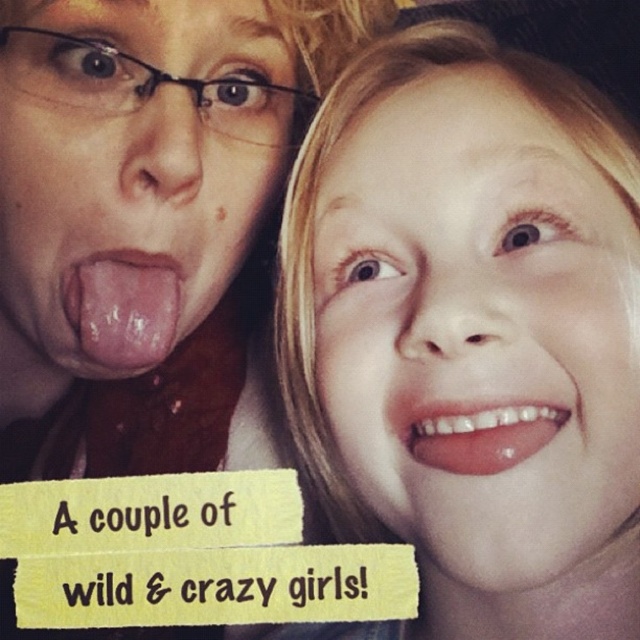
Is pink flesh tongue at center closer to camera compared to pink glossy lips at lower right?

No, pink flesh tongue at center is behind pink glossy lips at lower right.

Is pink flesh tongue at center behind pink glossy lips at lower right?

Yes, it is behind pink glossy lips at lower right.

This screenshot has height=640, width=640. What are the coordinates of `pink flesh tongue at center` in the screenshot? It's located at (122, 308).

Who is taller, pink flesh at center or pink glossy lips at lower right?

With more height is pink flesh at center.

Does pink flesh at center come behind pink glossy lips at lower right?

Yes, it is.

Does point (232, 264) come behind point (522, 406)?

That is True.

Locate an element on the screen. Image resolution: width=640 pixels, height=640 pixels. pink flesh at center is located at coordinates (131, 173).

Does smooth skin face at upper right appear under pink flesh tongue at center?

No, smooth skin face at upper right is not below pink flesh tongue at center.

Is point (570, 179) farther from viewer compared to point (113, 301)?

No, (570, 179) is in front of (113, 301).

The height and width of the screenshot is (640, 640). Identify the location of smooth skin face at upper right. [x=477, y=330].